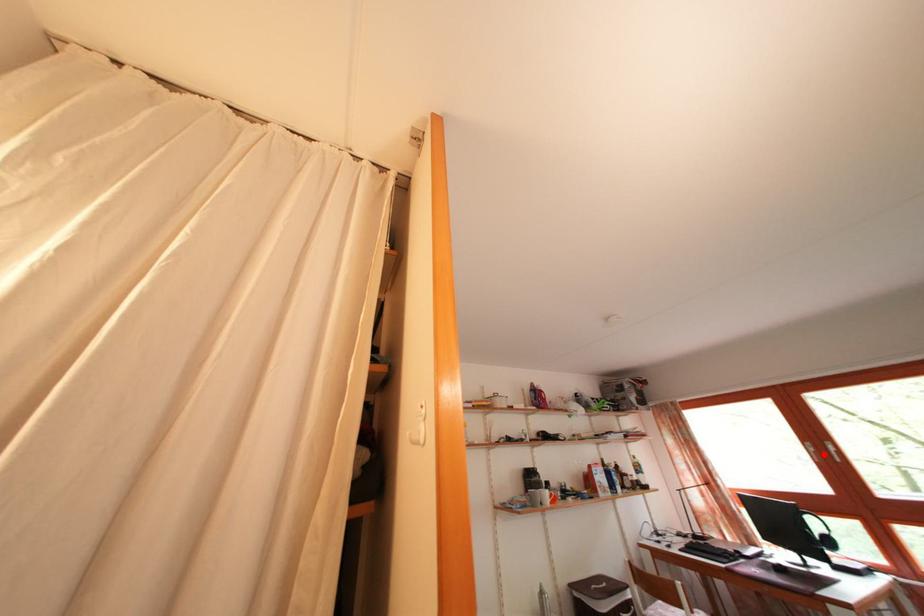
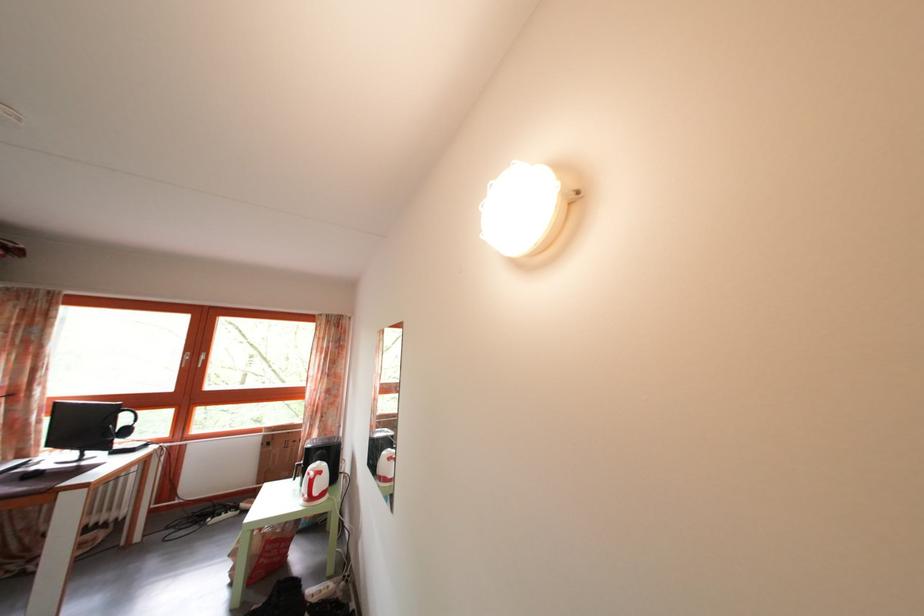
In the second image, find the point that corresponds to the highlighted location in the first image.

(199, 363)